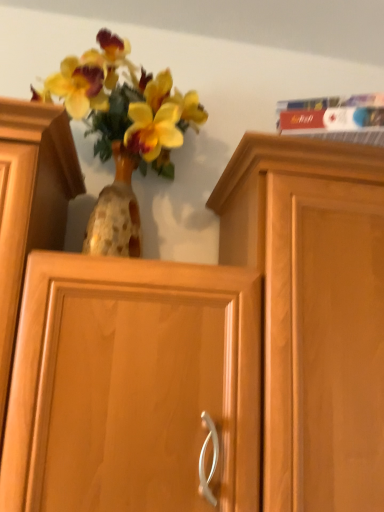
What do you see at coordinates (335, 118) in the screenshot?
I see `hardcover book at upper right` at bounding box center [335, 118].

This screenshot has width=384, height=512. I want to click on hardcover book at upper right, so click(335, 118).

Measure the distance between point [351,105] and camera.

A distance of 29.45 inches exists between point [351,105] and camera.

Measure the distance between hardcover book at upper right and camera.

The distance of hardcover book at upper right from camera is 28.90 inches.

The width and height of the screenshot is (384, 512). I want to click on hardcover book at upper right, so [x=335, y=118].